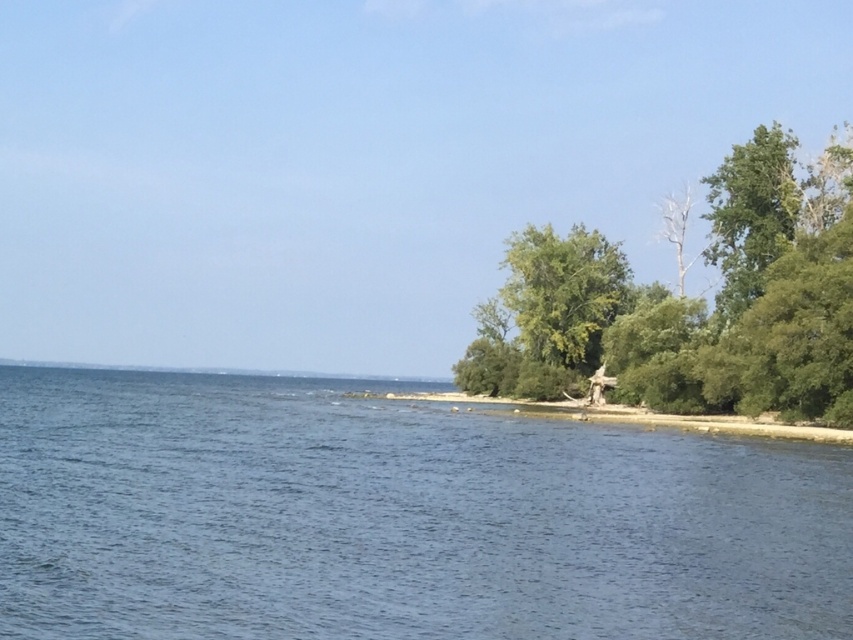
Question: Which object appears farthest from the camera in this image?

Choices:
 (A) green leafy tree at right
 (B) blue water at center
 (C) green leafy vegetation at lower right

Answer: (A)

Question: Estimate the real-world distances between objects in this image. Which object is closer to the blue water at center?

Choices:
 (A) green leafy tree at right
 (B) green leafy vegetation at lower right

Answer: (B)

Question: Is green leafy tree at right positioned at the back of green leafy vegetation at lower right?

Choices:
 (A) yes
 (B) no

Answer: (A)

Question: Where is green leafy tree at right located in relation to green leafy vegetation at lower right in the image?

Choices:
 (A) below
 (B) above

Answer: (B)

Question: Is blue water at center positioned before green leafy tree at right?

Choices:
 (A) yes
 (B) no

Answer: (A)

Question: Which object appears closest to the camera in this image?

Choices:
 (A) blue water at center
 (B) green leafy tree at right

Answer: (A)